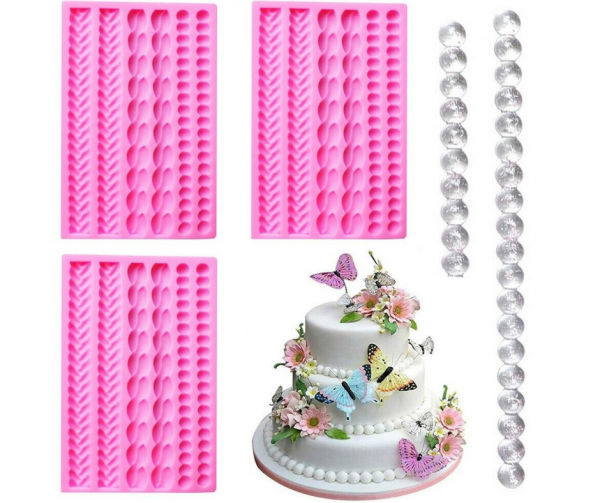
Find the location of a particular element. The image size is (600, 503). glass baubles is located at coordinates (450, 130), (508, 225).